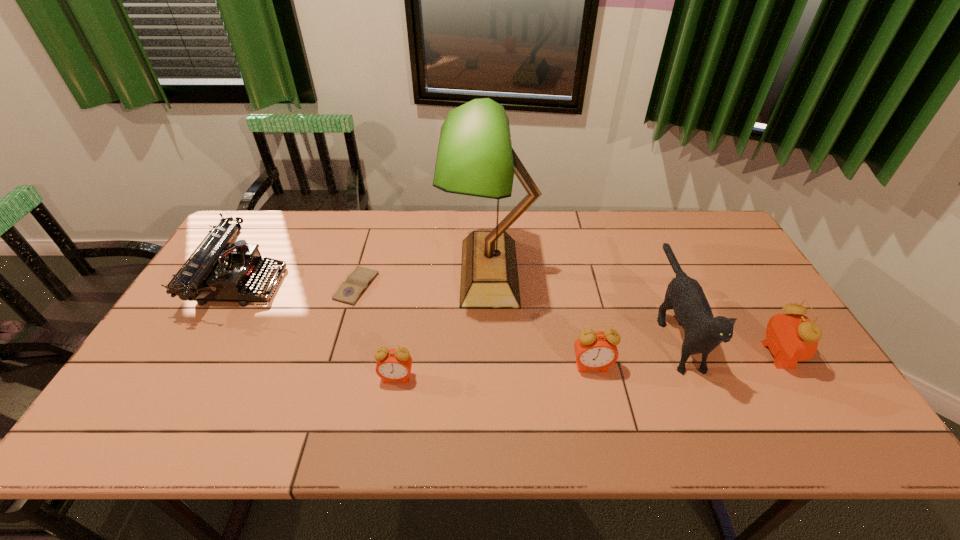
What are the coordinates of `the sixth object from left to right` in the screenshot? It's located at (703, 332).

Identify the location of cat. (703, 332).

The height and width of the screenshot is (540, 960). Identify the location of vacant space positioned on the face of the fifth object from left to right. (599, 399).

This screenshot has width=960, height=540. Identify the location of free space located 0.330m on the metallic stand of the fourth object from right to left. (339, 272).

Identify the location of vacant space located 0.370m on the metallic stand of the fourth object from right to left. This screenshot has width=960, height=540. (326, 272).

Identify the location of free point located on the metallic stand of the fourth object from right to left. The width and height of the screenshot is (960, 540). (377, 272).

You are a GUI agent. You are given a task and a screenshot of the screen. Output one action in this format:
    pyautogui.click(x=<x>, y=<y>)
    Task: Click on the free space located 0.070m on the back of the shortest object
    The image size is (960, 540).
    Given the screenshot: What is the action you would take?
    pyautogui.click(x=366, y=254)

I want to click on free space located 0.140m on the keyboard of the typewriter, so click(327, 282).

Where is `table lamp located at the far edge`? This screenshot has width=960, height=540. table lamp located at the far edge is located at coordinates (475, 157).

Locate an element on the screen. Image resolution: width=960 pixels, height=540 pixels. typewriter that is at the far edge is located at coordinates (223, 269).